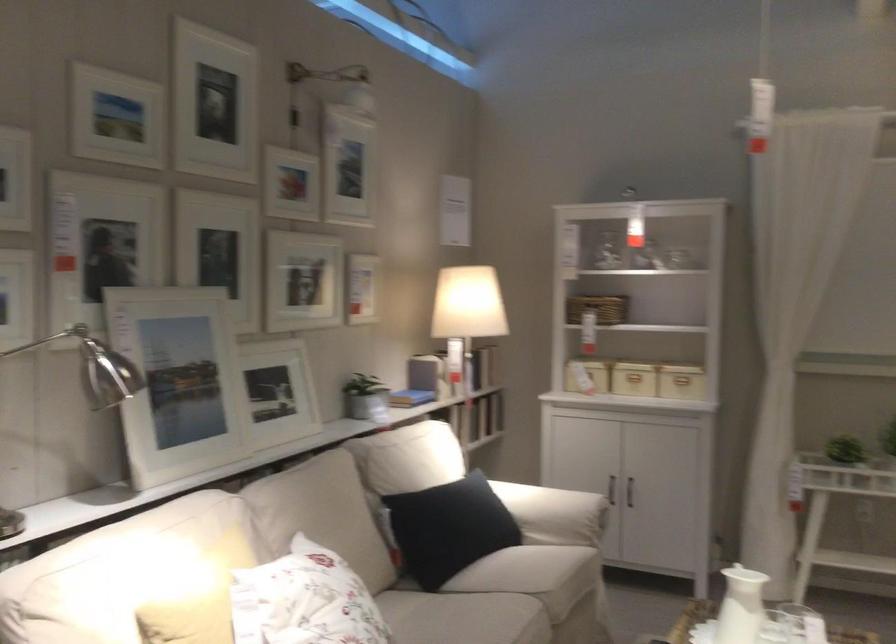
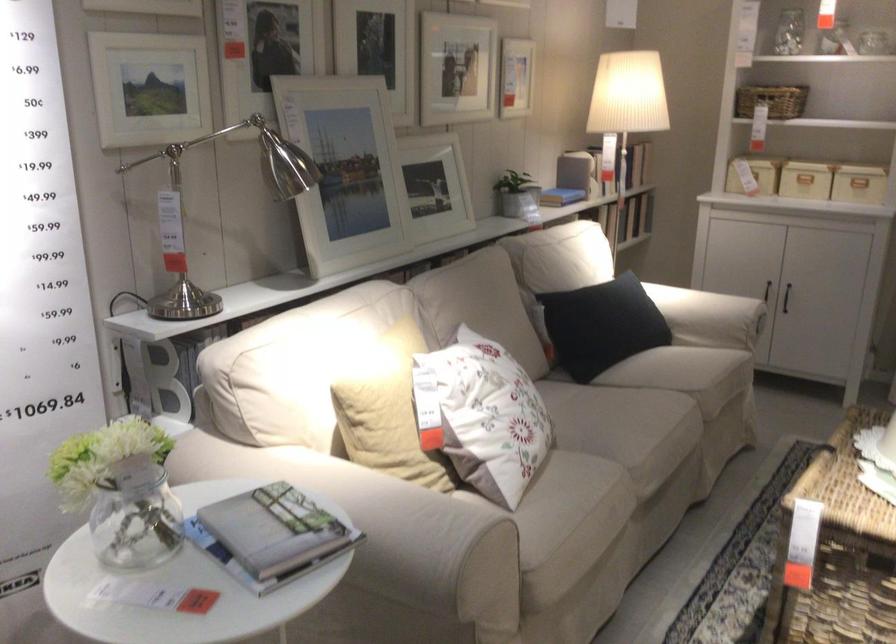
Locate, in the second image, the point that corresponds to (411,406) in the first image.

(561, 194)